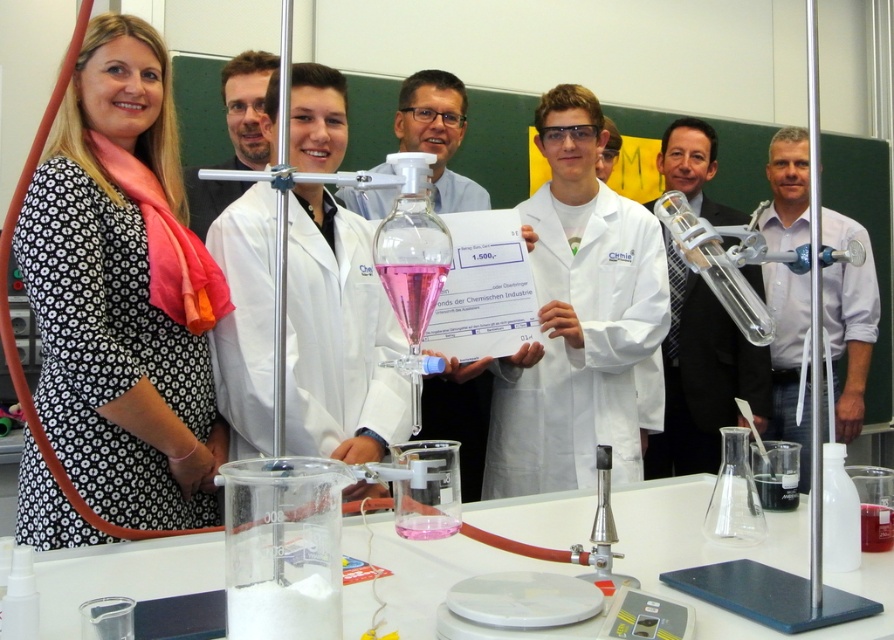
You are an observer standing in front of the table with the scientific equipment. You need to place a protective cover over the white lab coat at center and the clear glass tube at center. Which object should you cover first to avoid blocking the view of the other object?

The clear glass tube at center should be covered first because the white lab coat at center is wider than the clear glass tube at center, so covering the narrower tube first would prevent it from being obscured by the wider coat.

Based on the photo, you are a photographer positioned in front of the table with the burette and conical flask. You want to take a photo of the white shirt at center and the matte black lab coat at center so that both are clearly visible. Which one should be placed higher in the frame to ensure both are visible?

The white shirt at center is below matte black lab coat at center, so to ensure both are visible in the photo, the matte black lab coat at center should be placed higher in the frame.